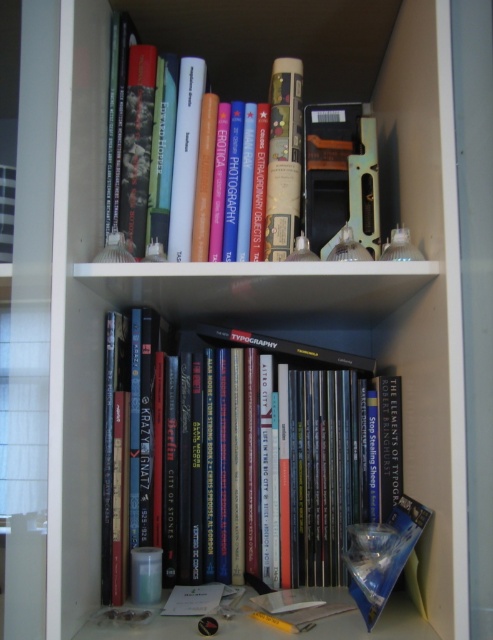
Question: Which object appears farthest from the camera in this image?

Choices:
 (A) hardcover books at center
 (B) hardcover book at upper center

Answer: (B)

Question: Can you confirm if hardcover books at center is positioned above hardcover book at upper center?

Choices:
 (A) no
 (B) yes

Answer: (A)

Question: Can you confirm if hardcover books at center is positioned above hardcover book at upper center?

Choices:
 (A) yes
 (B) no

Answer: (B)

Question: Can you confirm if hardcover books at center is wider than hardcover book at upper center?

Choices:
 (A) yes
 (B) no

Answer: (B)